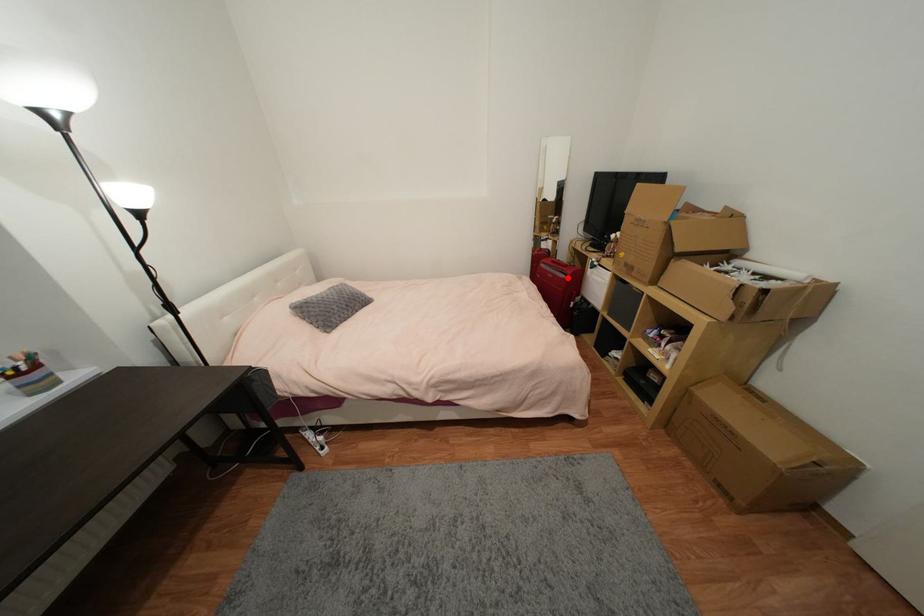
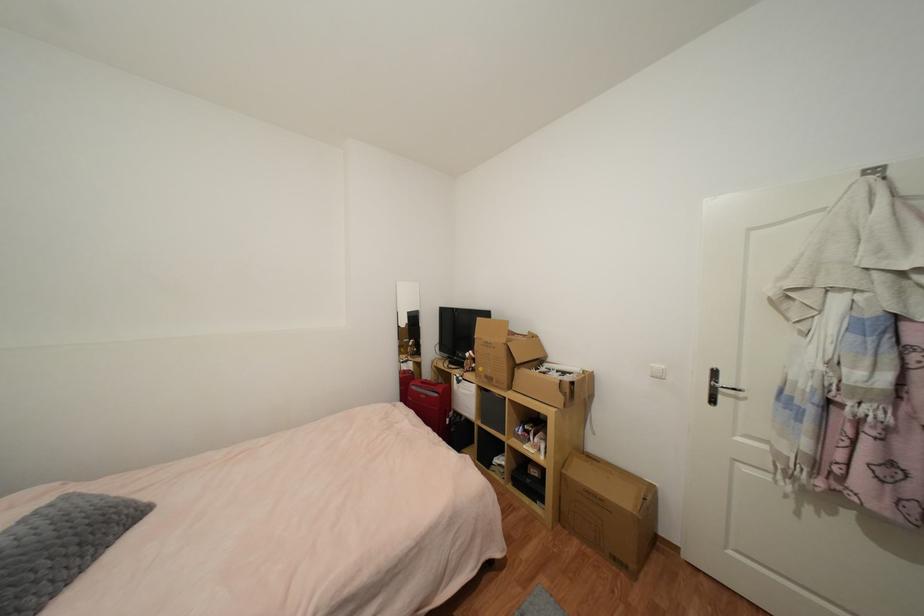
Question: I am providing you with two images of the same scene from different viewpoints. A red point is marked on the first image. Can you still see the location of the red point in image 2?

Choices:
 (A) Yes
 (B) No

Answer: (A)